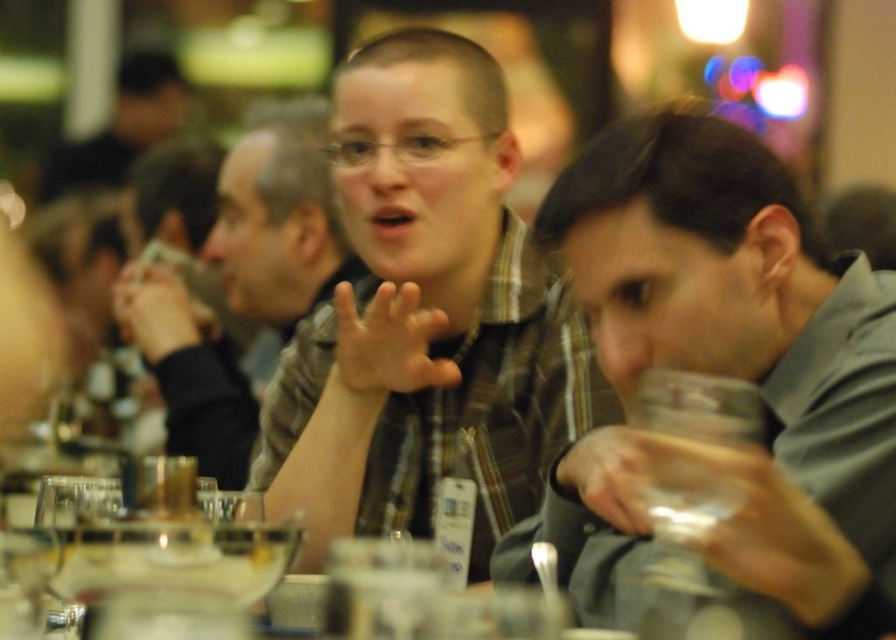
You are a photographer at the event and want to adjust your camera to focus on both the gray matte glass at right and the plaid shirt at center simultaneously. Knowing that your camera can focus on objects within a 1 meter range, will you be able to do so?

The gray matte glass at right is 1.29 meters away from the plaid shirt at center. Since the distance between them exceeds the camera focus range of 1 meter, you cannot focus on both simultaneously.

In the scene shown: You are a photographer adjusting the lighting for a portrait. You need to ensure that the gray matte glass at right and the matte plaid shirt at center are both well lit. Given their distance apart, can you estimate if a single light source placed centrally between them would provide adequate illumination for both?

The gray matte glass at right is 18.91 inches from the matte plaid shirt at center. A single light source placed centrally between them would be approximately 9.45 inches from each object, which should provide adequate illumination for both as the distance is relatively short and the light can evenly reach both subjects.